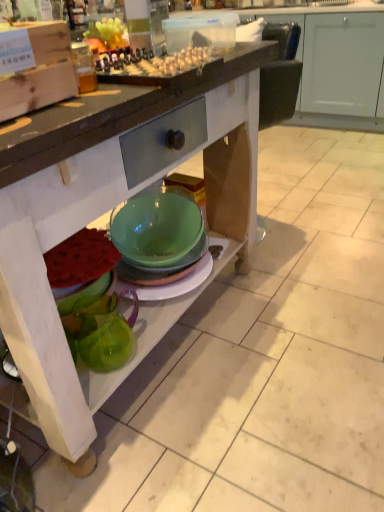
Question: Considering the relative positions of green glass pitcher at lower left and matte wood cabinet at upper center in the image provided, is green glass pitcher at lower left to the left or to the right of matte wood cabinet at upper center?

Choices:
 (A) right
 (B) left

Answer: (B)

Question: Is point (66, 314) closer or farther from the camera than point (241, 19)?

Choices:
 (A) closer
 (B) farther

Answer: (A)

Question: Which is farther from the green glass bowl at lower center?

Choices:
 (A) green glass pitcher at lower left
 (B) translucent plastic container at upper center
 (C) matte wood cabinet at upper center

Answer: (C)

Question: Which of these objects is positioned closest to the green glass pitcher at lower left?

Choices:
 (A) matte wood cabinet at upper center
 (B) translucent plastic container at upper center
 (C) green glass bowl at lower center

Answer: (C)